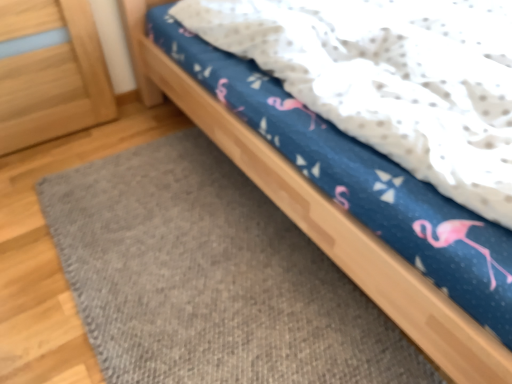
Describe the element at coordinates (210, 277) in the screenshot. I see `gray textured rug at lower left` at that location.

Measure the distance between point (274,291) and camera.

The distance of point (274,291) from camera is 4.71 feet.

Locate an element on the screen. Image resolution: width=512 pixels, height=384 pixels. gray textured rug at lower left is located at coordinates (210, 277).

Where is `gray textured rug at lower left`? The width and height of the screenshot is (512, 384). gray textured rug at lower left is located at coordinates (210, 277).